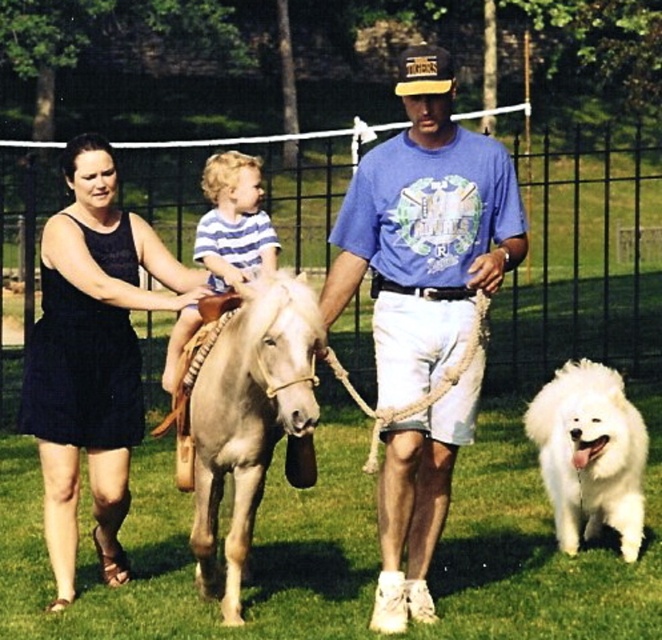
Question: Considering the relative positions of blue cotton shirt at center and striped cotton shirt at center in the image provided, where is blue cotton shirt at center located with respect to striped cotton shirt at center?

Choices:
 (A) below
 (B) above

Answer: (A)

Question: Which point is closer to the camera taking this photo?

Choices:
 (A) (418, 243)
 (B) (246, 275)
 (C) (132, 429)
 (D) (453, 342)

Answer: (A)

Question: Does blue cotton shirt at center have a smaller size compared to white fluffy dog at lower right?

Choices:
 (A) yes
 (B) no

Answer: (B)

Question: Considering the real-world distances, which object is farthest from the striped cotton shirt at center?

Choices:
 (A) white matte pony at center
 (B) light gray leather saddle at center
 (C) black lace dress at left

Answer: (A)

Question: Does light gray leather saddle at center have a smaller size compared to white fluffy dog at lower right?

Choices:
 (A) no
 (B) yes

Answer: (A)

Question: Which of these objects is positioned farthest from the light gray leather saddle at center?

Choices:
 (A) blue cotton shirt at center
 (B) white matte pony at center
 (C) white fluffy dog at lower right

Answer: (C)